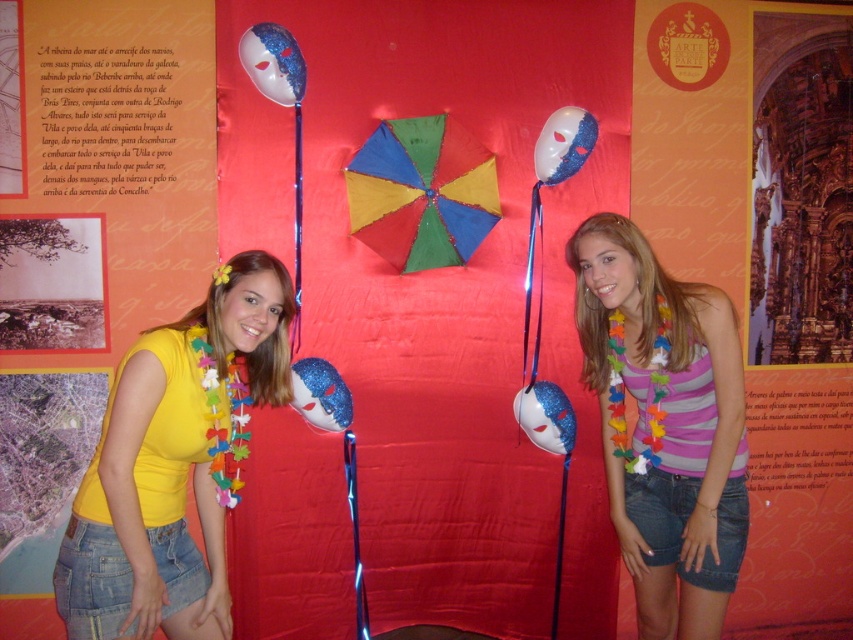
Question: Does blue glitter mask at center appear on the left side of blue glossy mask at center?

Choices:
 (A) yes
 (B) no

Answer: (A)

Question: Can you confirm if shiny blue mask at center is smaller than blue glossy mask at center?

Choices:
 (A) no
 (B) yes

Answer: (A)

Question: Which point is closer to the camera?

Choices:
 (A) yellow fabric top at center
 (B) shiny blue mask at center
 (C) glittery white mask at upper center
 (D) blue glossy mask at center

Answer: (A)

Question: Which of the following is the closest to the observer?

Choices:
 (A) (538, 419)
 (B) (297, 49)
 (C) (463, 218)

Answer: (B)

Question: Is shiny blue mask at center to the right of glittery white mask at upper center from the viewer's perspective?

Choices:
 (A) no
 (B) yes

Answer: (A)

Question: Estimate the real-world distances between objects in this image. Which object is farther from the blue glitter mask at center?

Choices:
 (A) striped jersey at center
 (B) glittery white mask at upper center
 (C) blue glossy mask at center
 (D) yellow fabric top at center

Answer: (B)